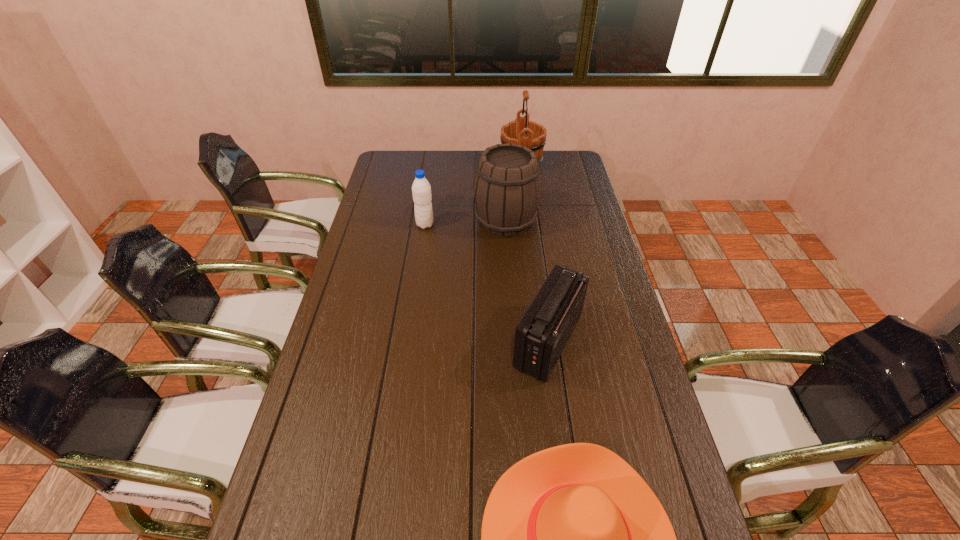
Where is `the taller wine bucket`? the taller wine bucket is located at coordinates (530, 134).

The height and width of the screenshot is (540, 960). I want to click on the tallest object, so click(530, 134).

The height and width of the screenshot is (540, 960). I want to click on the fourth shortest object, so 507,188.

The height and width of the screenshot is (540, 960). Find the location of `the nearer wine bucket`. the nearer wine bucket is located at coordinates (507, 188).

You are a GUI agent. You are given a task and a screenshot of the screen. Output one action in this format:
    pyautogui.click(x=<x>, y=<y>)
    Task: Click on the water bottle
    
    Given the screenshot: What is the action you would take?
    pyautogui.click(x=421, y=190)

I want to click on radio receiver, so click(542, 333).

Find the location of a particular element. This screenshot has height=540, width=960. vacant space situated on the front of the farther wine bucket is located at coordinates (527, 208).

Locate an element on the screen. free space located 0.250m on the back of the fourth shortest object is located at coordinates (502, 171).

Where is `vacant space located on the left of the water bottle`? This screenshot has width=960, height=540. vacant space located on the left of the water bottle is located at coordinates (363, 225).

Find the location of a particular element. vacant area situated on the front panel of the second nearest object is located at coordinates (473, 341).